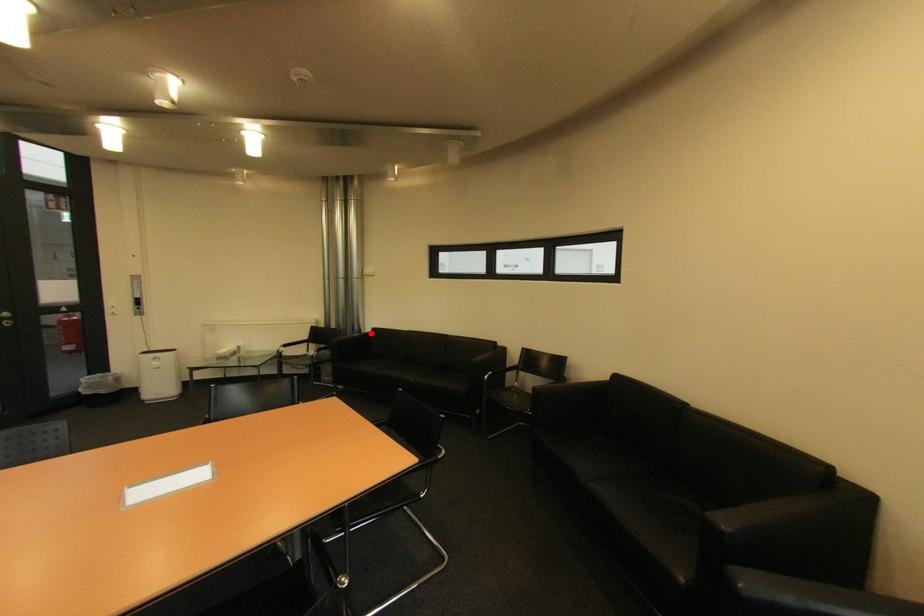
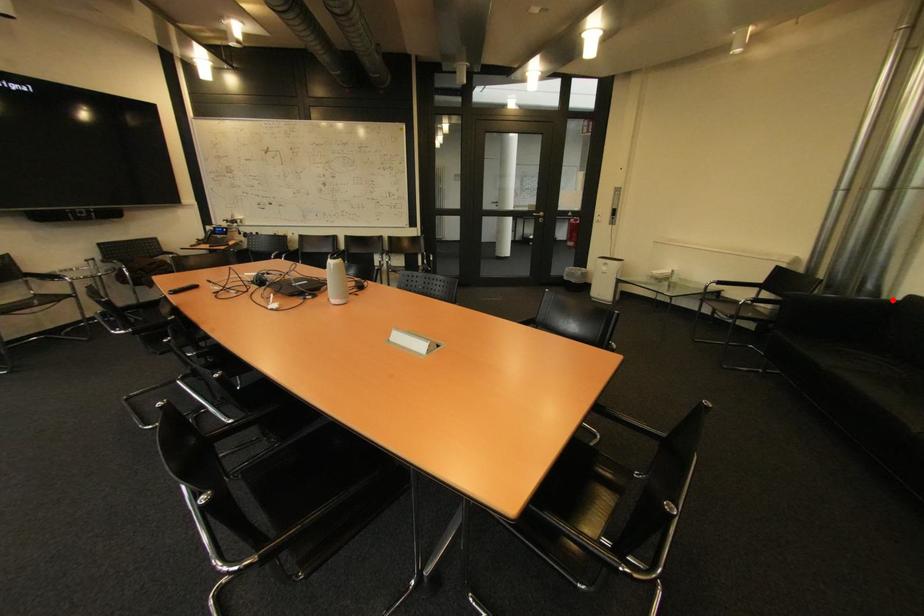
I am providing you with two images of the same scene from different viewpoints. A red point is marked on the first image and another point is marked on the second image. Does the point marked in image1 correspond to the same location as the one in image2?

Yes